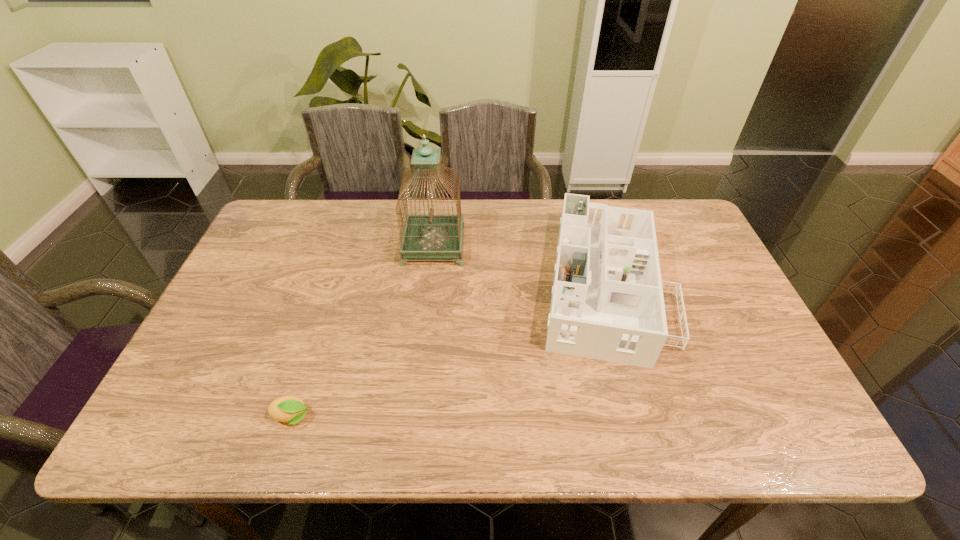
I want to click on the tallest object, so click(430, 236).

Find the location of a particular element. the second object from right to left is located at coordinates (430, 236).

This screenshot has height=540, width=960. Find the location of `dollhouse`. dollhouse is located at coordinates click(607, 303).

Find the location of a particular element. The height and width of the screenshot is (540, 960). the rightmost object is located at coordinates (607, 303).

I want to click on the leftmost object, so click(x=291, y=409).

Where is `the nearest object`? The width and height of the screenshot is (960, 540). the nearest object is located at coordinates (291, 409).

The height and width of the screenshot is (540, 960). I want to click on free space located 0.380m at the door of the birdcage, so click(587, 246).

Identify the location of blank space located on the left of the rightmost object. (494, 286).

At what (x,y) coordinates should I click in order to perform the action: click on vacant region located with leaves positioned above the leftmost object. Please return your answer as a coordinate pair (x, y). Looking at the image, I should click on (382, 417).

The width and height of the screenshot is (960, 540). I want to click on birdcage at the far edge, so click(x=430, y=236).